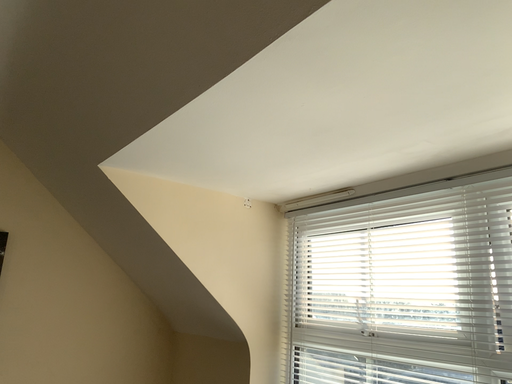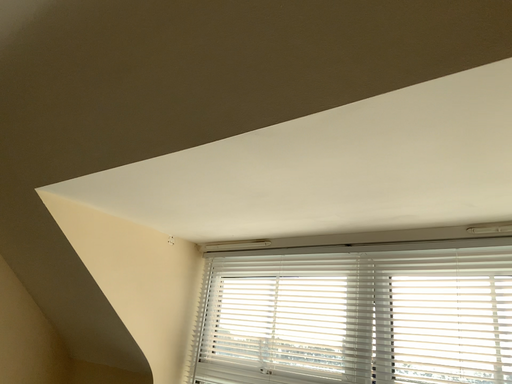
Question: How did the camera likely rotate when shooting the video?

Choices:
 (A) rotated left
 (B) rotated right

Answer: (B)